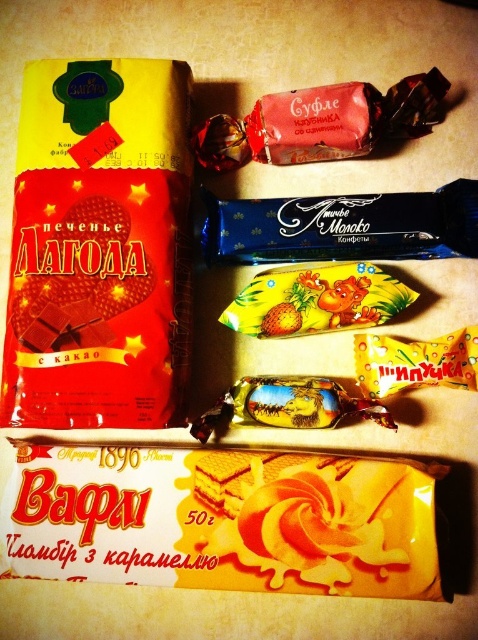
Is point (14, 304) farther from viewer compared to point (260, 332)?

No, it is not.

Is matte chocolate cookie at left above yellow matte candy at center?

Yes, matte chocolate cookie at left is above yellow matte candy at center.

Measure the distance between matte chocolate cookie at left and camera.

A distance of 1.11 meters exists between matte chocolate cookie at left and camera.

The height and width of the screenshot is (640, 478). I want to click on matte chocolate cookie at left, so pyautogui.click(x=98, y=246).

Does blue glossy chocolate bar at center appear over yellow glossy candy at center?

Yes.

Between point (253, 220) and point (379, 336), which one is positioned in front?

Point (379, 336) is in front.

This screenshot has height=640, width=478. Find the location of `blue glossy chocolate bar at center`. blue glossy chocolate bar at center is located at coordinates (343, 227).

Is the position of yellow creamy wafer at lower center less distant than that of yellow glossy candy at center?

Yes, it is in front of yellow glossy candy at center.

Does yellow creamy wafer at lower center appear over yellow glossy candy at center?

No.

Is point (312, 513) in front of point (467, 339)?

Yes.

The width and height of the screenshot is (478, 640). I want to click on yellow creamy wafer at lower center, so click(x=223, y=520).